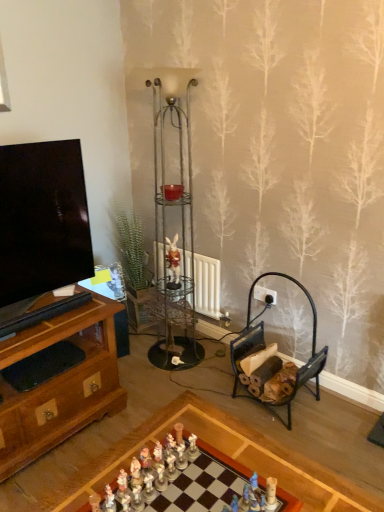
The height and width of the screenshot is (512, 384). Find the location of `free spot to the right of matte blue figurine at center, arranged as the first toy when viewed from the front`. free spot to the right of matte blue figurine at center, arranged as the first toy when viewed from the front is located at coordinates (299, 488).